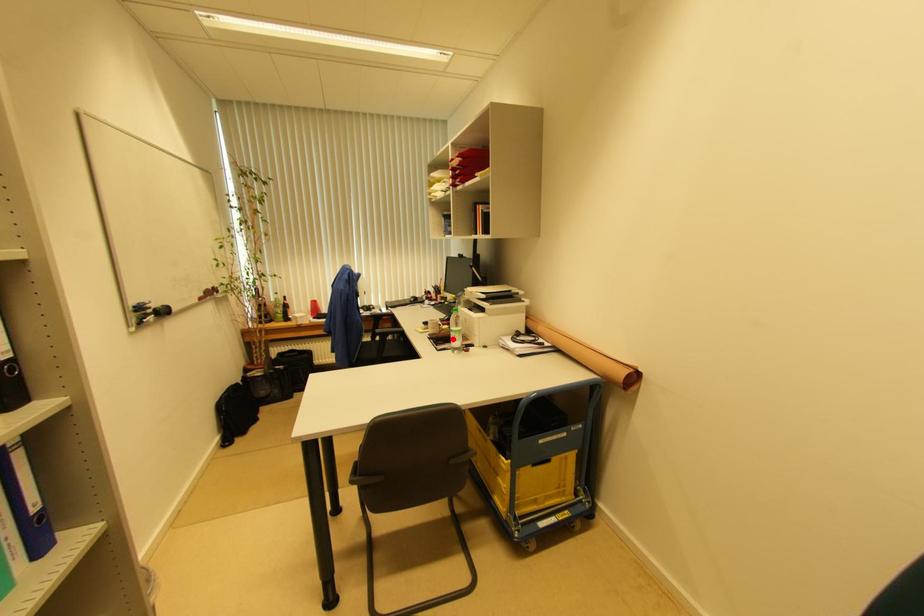
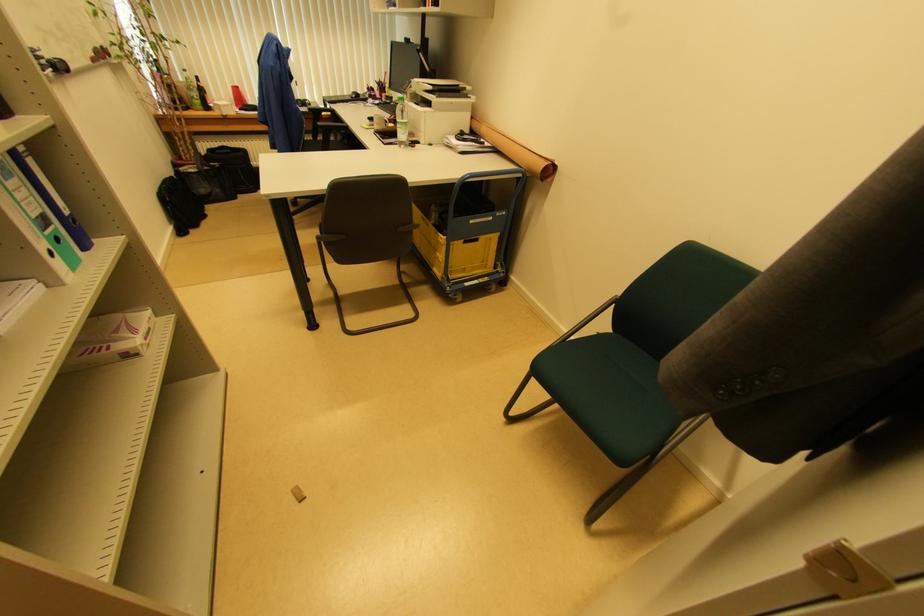
Question: A red point is marked in image1. In image2, is the corresponding 3D point closer to the camera or farther? Reply with the corresponding letter.

Choices:
 (A) The corresponding 3D point is closer.
 (B) The corresponding 3D point is farther.

Answer: (A)